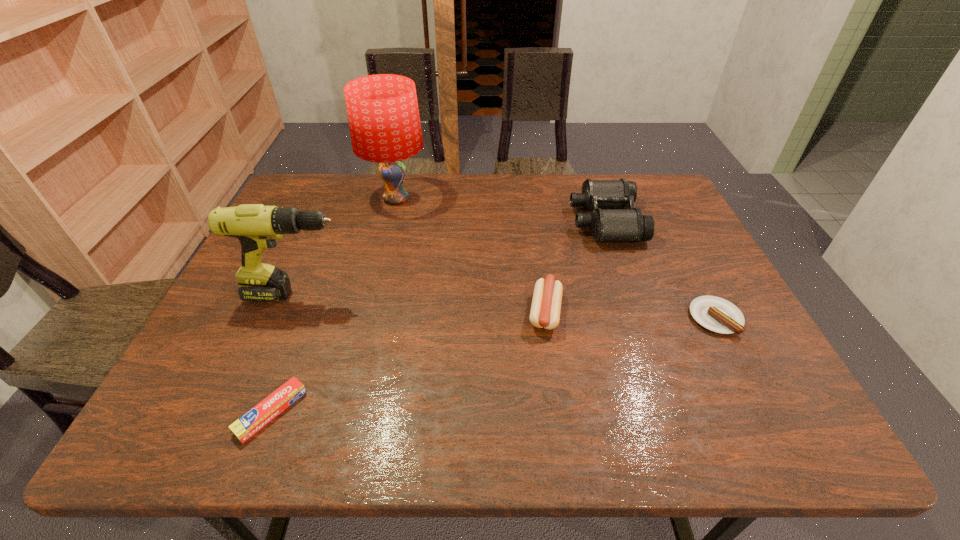
Where is `object that is at the near edge`? The image size is (960, 540). object that is at the near edge is located at coordinates (246, 426).

What are the coordinates of `drill that is positioned at the left edge` in the screenshot? It's located at (256, 226).

This screenshot has width=960, height=540. What are the coordinates of `toothpaste present at the left edge` in the screenshot? It's located at (246, 426).

What are the coordinates of `binoculars positioned at the right edge` in the screenshot? It's located at (609, 221).

You are a GUI agent. You are given a task and a screenshot of the screen. Output one action in this format:
    pyautogui.click(x=<x>, y=<y>)
    Task: Click on the sausage present at the right edge
    
    Given the screenshot: What is the action you would take?
    pyautogui.click(x=716, y=314)

Identify the location of object that is positioned at the near left corner. (246, 426).

Identify the location of object at the far right corner. The width and height of the screenshot is (960, 540). (x=609, y=221).

The height and width of the screenshot is (540, 960). I want to click on free space at the far edge of the desktop, so click(540, 205).

Identify the location of free point at the near edge. (490, 445).

Locate an element on the screen. The height and width of the screenshot is (540, 960). free space at the left edge of the desktop is located at coordinates (274, 335).